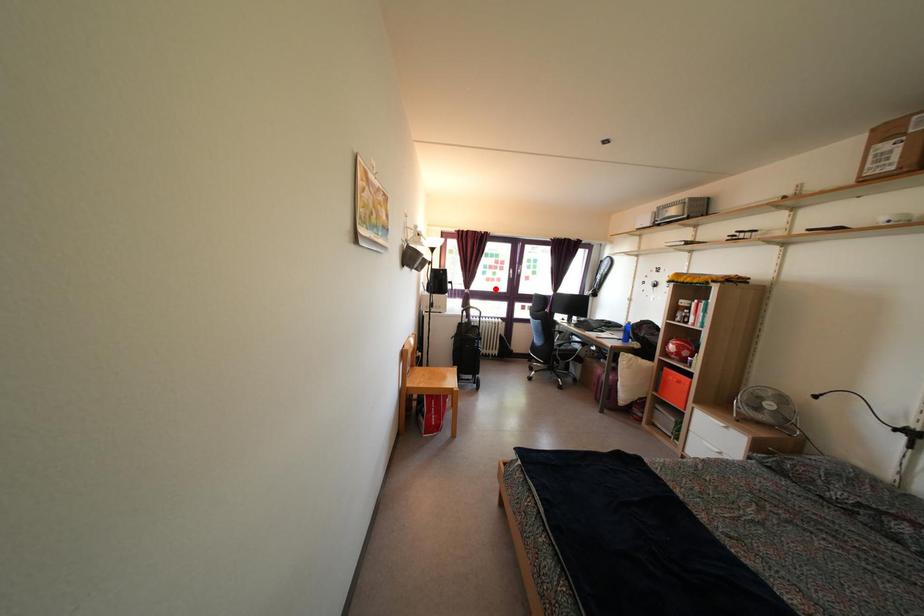
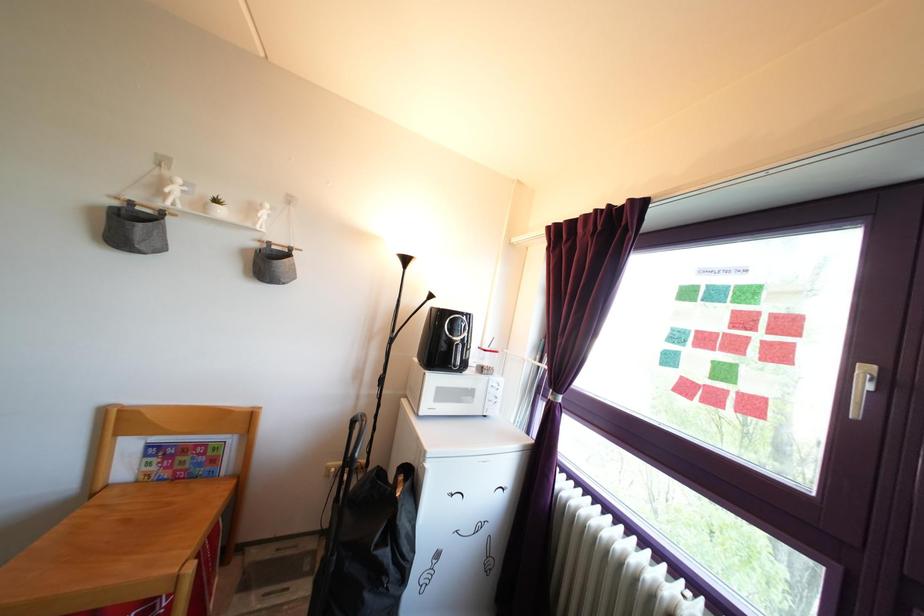
Where in the second image is the point corresponding to the highlighted location from the first image?

(715, 407)